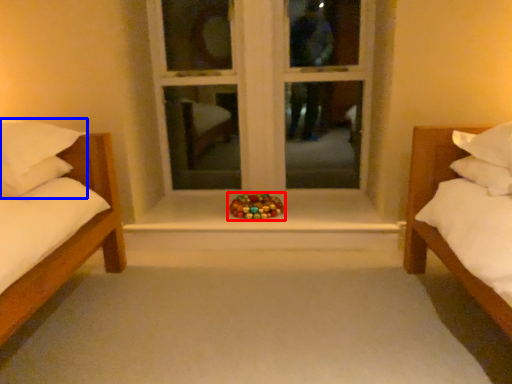
Question: Which object appears farthest to the camera in this image, toy (highlighted by a red box) or pillow (highlighted by a blue box)?

Choices:
 (A) toy
 (B) pillow

Answer: (A)